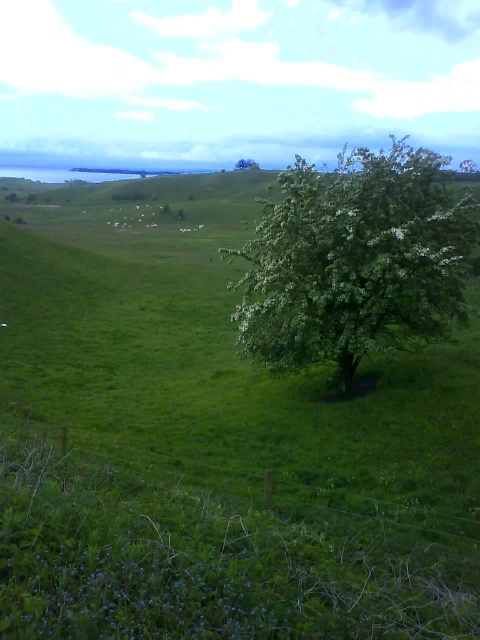
Question: Which point is farther to the camera?

Choices:
 (A) (241, 164)
 (B) (450, 298)

Answer: (A)

Question: Is green leafy tree at center above green leafy tree at upper center?

Choices:
 (A) yes
 (B) no

Answer: (B)

Question: Among these points, which one is farthest from the camera?

Choices:
 (A) (343, 264)
 (B) (241, 163)

Answer: (B)

Question: Is green leafy tree at center thinner than green leafy tree at upper center?

Choices:
 (A) no
 (B) yes

Answer: (B)

Question: Where is green leafy tree at center located in relation to green leafy tree at upper center in the image?

Choices:
 (A) below
 (B) above

Answer: (A)